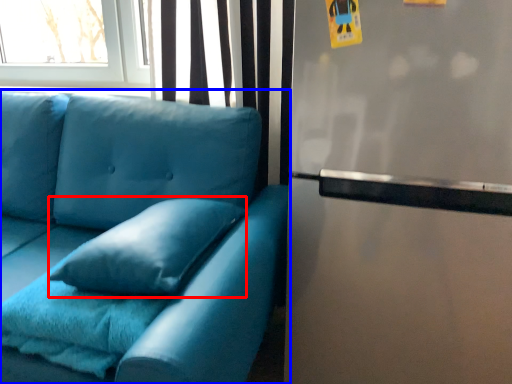
Question: Which point is closer to the camera, pillow (highlighted by a red box) or studio couch (highlighted by a blue box)?

Choices:
 (A) pillow
 (B) studio couch

Answer: (B)